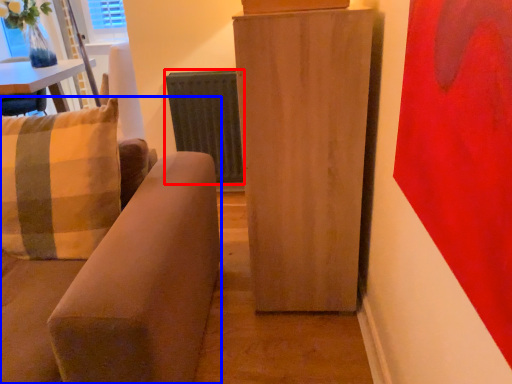
Question: Which point is further to the camera, radiator (highlighted by a red box) or studio couch (highlighted by a blue box)?

Choices:
 (A) radiator
 (B) studio couch

Answer: (A)